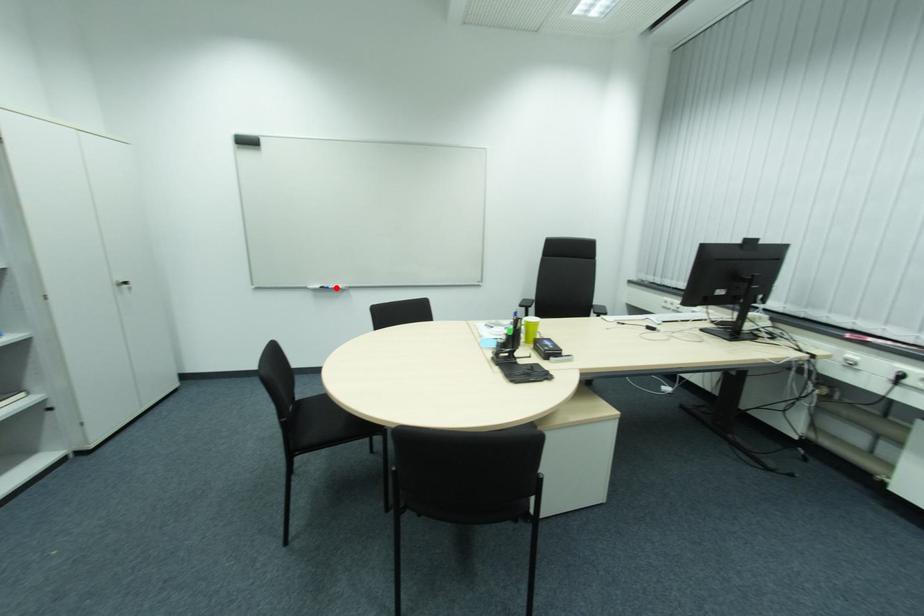
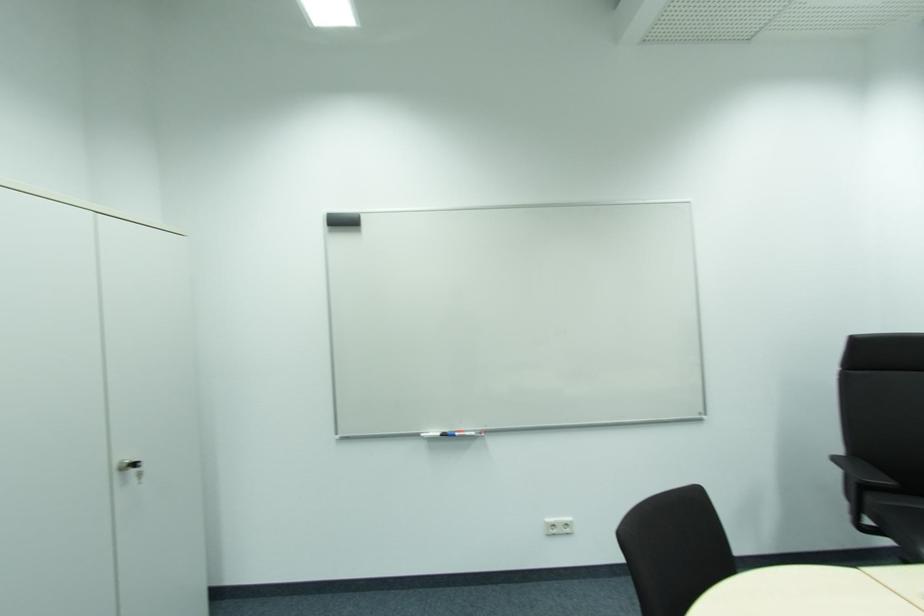
Find the pixel in the second image that matches the highlighted location in the first image.

(464, 434)